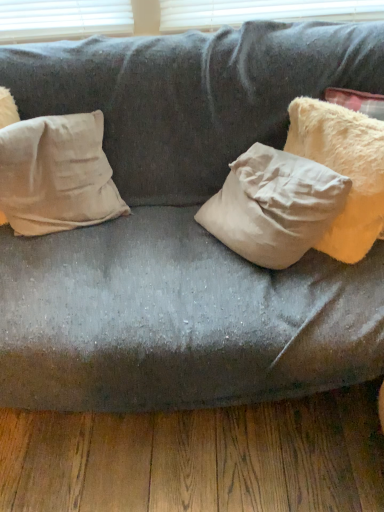
Question: In terms of size, does fuzzy cream pillow at right, acting as the 2th pillow starting from the left, appear bigger or smaller than beige cotton pillow at left, which appears as the 1th pillow when viewed from the left?

Choices:
 (A) big
 (B) small

Answer: (A)

Question: Is fuzzy cream pillow at right, acting as the first pillow starting from the right, situated inside beige cotton pillow at left, which appears as the 1th pillow when viewed from the left, or outside?

Choices:
 (A) outside
 (B) inside

Answer: (A)

Question: From a real-world perspective, is fuzzy cream pillow at right, acting as the 2th pillow starting from the left, physically located above or below beige cotton pillow at left, which appears as the 1th pillow when viewed from the left?

Choices:
 (A) below
 (B) above

Answer: (B)

Question: Is beige cotton pillow at left, which appears as the 1th pillow when viewed from the left, inside or outside of fuzzy cream pillow at right, acting as the 2th pillow starting from the left?

Choices:
 (A) outside
 (B) inside

Answer: (A)

Question: Would you say beige cotton pillow at left, which is the second pillow in right-to-left order, is to the left or to the right of fuzzy cream pillow at right, acting as the 2th pillow starting from the left, in the picture?

Choices:
 (A) left
 (B) right

Answer: (A)

Question: Looking at their shapes, would you say beige cotton pillow at left, which appears as the 1th pillow when viewed from the left, is wider or thinner than fuzzy cream pillow at right, acting as the 2th pillow starting from the left?

Choices:
 (A) wide
 (B) thin

Answer: (B)

Question: From the image's perspective, is beige cotton pillow at left, which appears as the 1th pillow when viewed from the left, positioned above or below fuzzy cream pillow at right, acting as the 2th pillow starting from the left?

Choices:
 (A) above
 (B) below

Answer: (B)